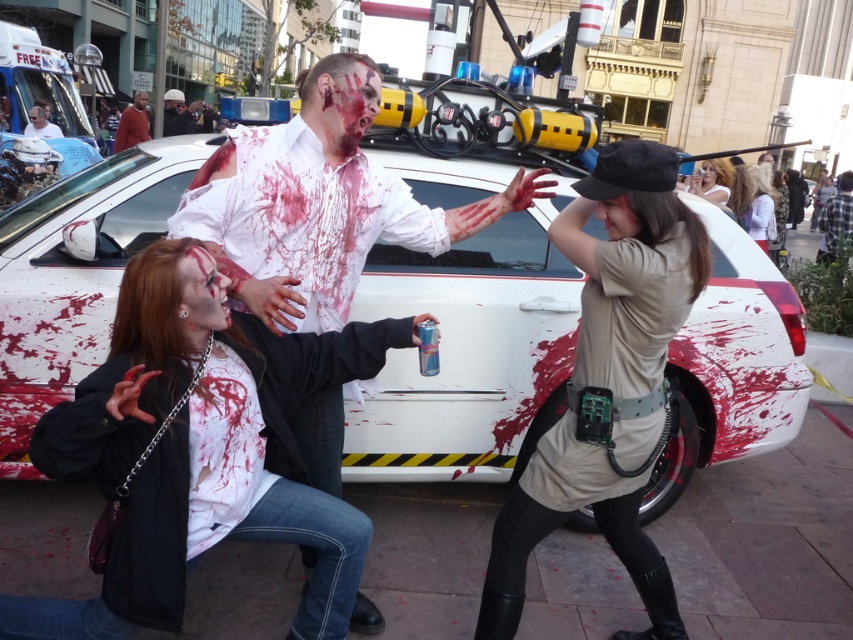
Between light brown hair at upper right and white matte shirt at upper right, which one appears on the left side from the viewer's perspective?

light brown hair at upper right

Does point (761, 227) come in front of point (770, 211)?

Yes, it is in front of point (770, 211).

Locate an element on the screen. The image size is (853, 640). light brown hair at upper right is located at coordinates (752, 202).

Does point (601, 492) lie behind point (701, 177)?

No, (601, 492) is in front of (701, 177).

Is point (611, 492) positioned after point (722, 166)?

No.

You are a GUI agent. You are given a task and a screenshot of the screen. Output one action in this format:
    pyautogui.click(x=<x>, y=<y>)
    Task: Click on the tan fabric utility belt at lower right
    This screenshot has height=640, width=853.
    Given the screenshot: What is the action you would take?
    pyautogui.click(x=613, y=362)

Between white plastic ambulance at upper left and brown leather jacket at upper left, which one has more height?

Standing taller between the two is white plastic ambulance at upper left.

Who is more forward, (15, 29) or (131, 109)?

Positioned in front is point (15, 29).

The height and width of the screenshot is (640, 853). What do you see at coordinates (44, 93) in the screenshot? I see `white plastic ambulance at upper left` at bounding box center [44, 93].

Find the location of a particular element. white plastic ambulance at upper left is located at coordinates (44, 93).